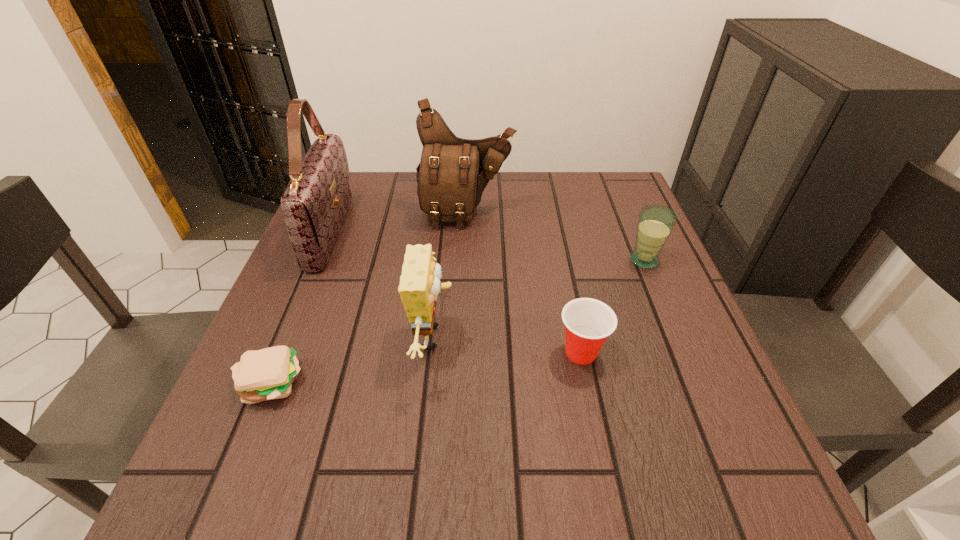
At what (x,y) coordinates should I click in order to perform the action: click on free space located on the face of the fourth shortest object. Please return your answer as a coordinate pair (x, y). The image size is (960, 540). Looking at the image, I should click on (574, 337).

This screenshot has width=960, height=540. I want to click on free space located 0.340m on the front of the third shortest object, so click(x=705, y=407).

This screenshot has height=540, width=960. I want to click on free space located on the front of the second shortest object, so click(611, 496).

Where is `free spot located on the back of the shortest object`? This screenshot has width=960, height=540. free spot located on the back of the shortest object is located at coordinates (326, 243).

This screenshot has width=960, height=540. What are the coordinates of `handbag located in the far edge section of the desktop` in the screenshot? It's located at (315, 202).

Where is `shoulder bag that is at the far edge`? The width and height of the screenshot is (960, 540). shoulder bag that is at the far edge is located at coordinates (453, 172).

The image size is (960, 540). Find the location of `handbag that is at the left edge`. handbag that is at the left edge is located at coordinates (315, 202).

The height and width of the screenshot is (540, 960). In order to click on patty at the left edge in this screenshot , I will do `click(266, 374)`.

Image resolution: width=960 pixels, height=540 pixels. Find the location of `object at the right edge`. object at the right edge is located at coordinates (655, 223).

The width and height of the screenshot is (960, 540). I want to click on object present at the far left corner, so click(315, 202).